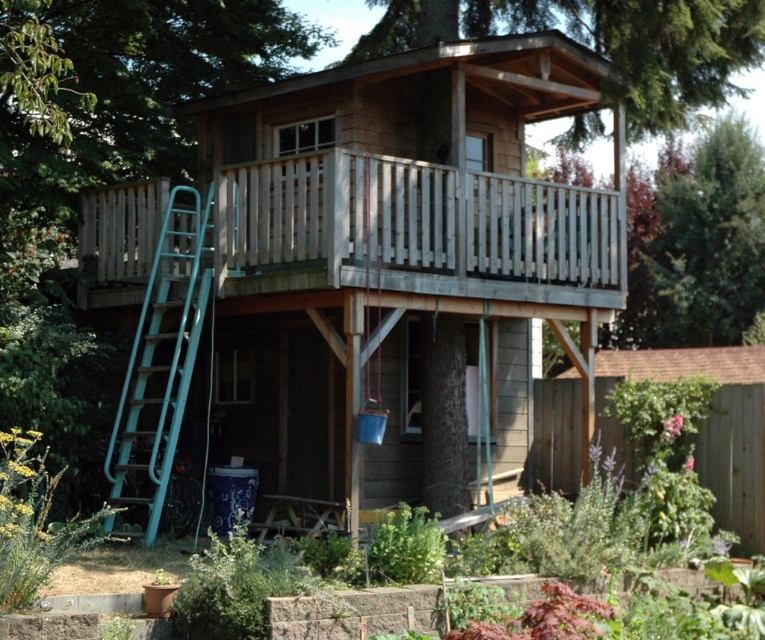
Does weathered wood porch at upper center have a larger size compared to teal metallic ladder at left?

No, weathered wood porch at upper center is not bigger than teal metallic ladder at left.

Which is below, weathered wood porch at upper center or teal metallic ladder at left?

teal metallic ladder at left

Does point (523, 294) come farther from viewer compared to point (161, 252)?

No, it is in front of (161, 252).

Image resolution: width=765 pixels, height=640 pixels. I want to click on weathered wood porch at upper center, so click(x=415, y=230).

Is wooden deck at upper center smaller than green leafy tree at upper right?

Yes, wooden deck at upper center is smaller than green leafy tree at upper right.

Does wooden deck at upper center have a greater width compared to green leafy tree at upper right?

Incorrect, wooden deck at upper center's width does not surpass green leafy tree at upper right's.

Between point (334, 408) and point (648, 339), which one is positioned in front?

Point (334, 408)

Identify the location of wooden deck at upper center. (350, 262).

Does brown wooden porch at upper center lie behind green leafy tree at upper right?

No, it is not.

Can you confirm if brown wooden porch at upper center is bigger than green leafy tree at upper right?

No.

Is point (591, 134) in front of point (692, 186)?

That is True.

Where is `brown wooden porch at upper center`? Image resolution: width=765 pixels, height=640 pixels. brown wooden porch at upper center is located at coordinates (604, 44).